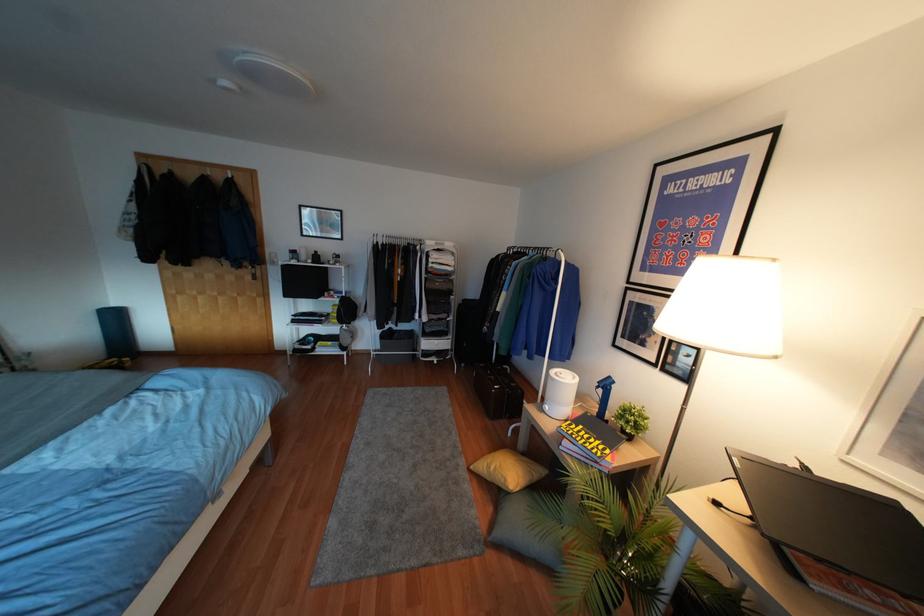
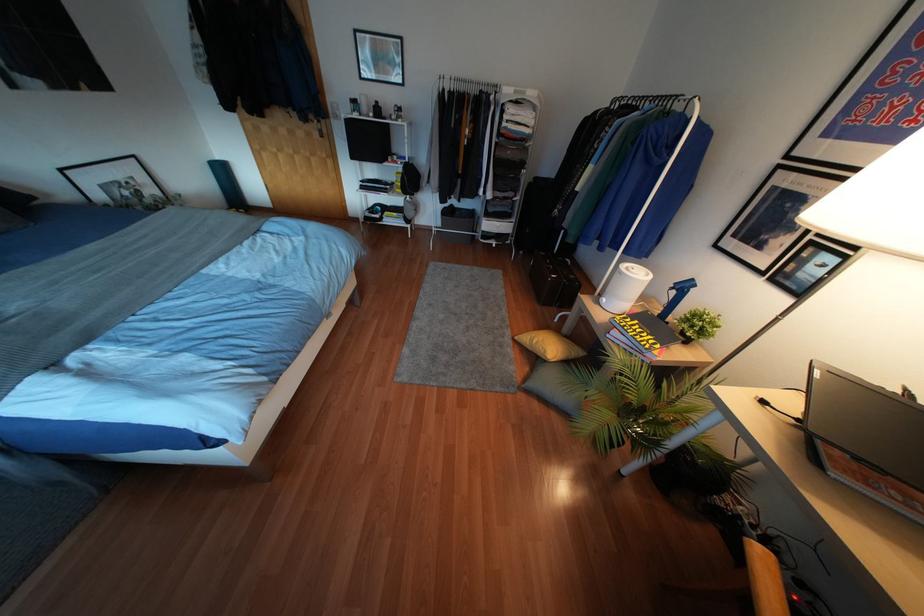
The point at (497, 546) is marked in the first image. Where is the corresponding point in the second image?

(528, 392)